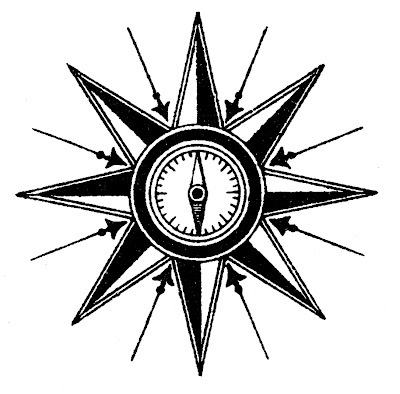
This screenshot has width=400, height=394. Find the location of `top of inner white ring on face of clock`. top of inner white ring on face of clock is located at coordinates (197, 149).